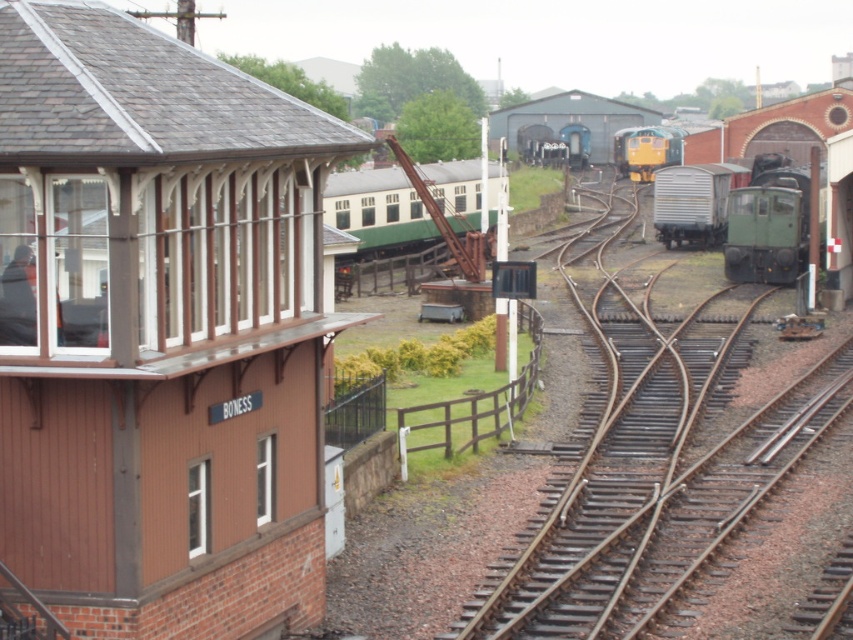
Question: Among these objects, which one is farthest from the camera?

Choices:
 (A) brown metal train track at center
 (B) green painted wood passenger train at center

Answer: (B)

Question: Which object is the farthest from the brown metal train track at center?

Choices:
 (A) brown wood railway station at upper left
 (B) silver metallic wagon at center
 (C) green matte train at center-right
 (D) green painted wood passenger train at center

Answer: (B)

Question: Which object is farther from the camera taking this photo?

Choices:
 (A) brown wood railway station at upper left
 (B) green painted wood passenger train at center
 (C) silver metallic wagon at center
 (D) brown metal train track at center

Answer: (C)

Question: Does green matte train at center-right have a greater width compared to yellow/green metal train at center?

Choices:
 (A) yes
 (B) no

Answer: (A)

Question: Can you confirm if brown metal train track at center is positioned below green matte train at center-right?

Choices:
 (A) no
 (B) yes

Answer: (B)

Question: Is green painted wood passenger train at center to the right of silver metallic wagon at center from the viewer's perspective?

Choices:
 (A) yes
 (B) no

Answer: (B)